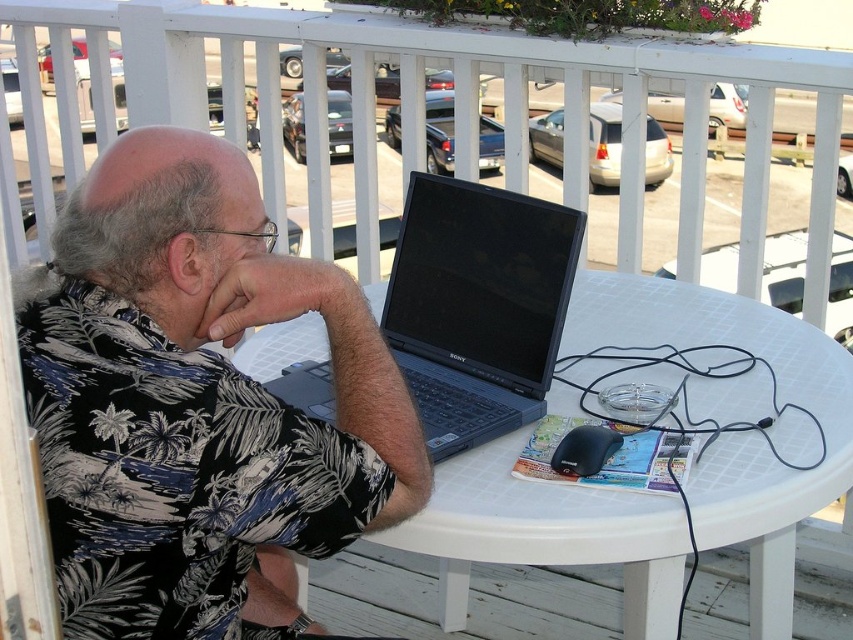
Question: Is white plastic table at center below black plastic laptop at center?

Choices:
 (A) no
 (B) yes

Answer: (B)

Question: Which object is closer to the camera taking this photo?

Choices:
 (A) white plastic table at center
 (B) black plastic laptop at center

Answer: (A)

Question: Is white plastic table at center below black plastic laptop at center?

Choices:
 (A) yes
 (B) no

Answer: (A)

Question: Estimate the real-world distances between objects in this image. Which object is farther from the white plastic table at center?

Choices:
 (A) black plastic laptop at center
 (B) black floral shirt at center

Answer: (B)

Question: Does black floral shirt at center come in front of white plastic table at center?

Choices:
 (A) no
 (B) yes

Answer: (B)

Question: Which point appears farthest from the camera in this image?

Choices:
 (A) (767, 388)
 (B) (328, 445)
 (C) (469, 355)

Answer: (C)